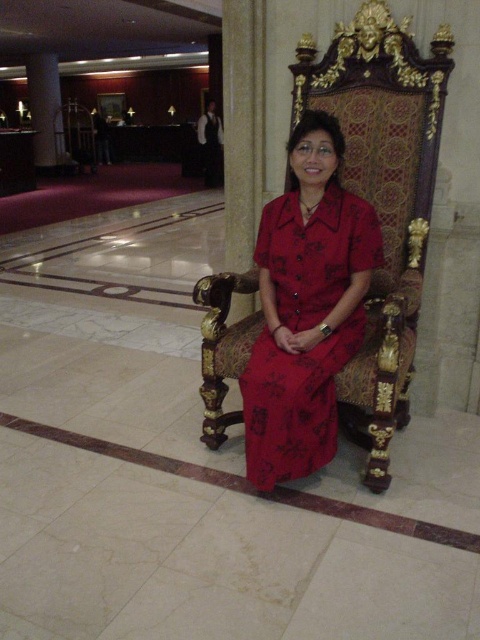
Consider the image. Is wooden carved throne at center thinner than matte red dress at center?

In fact, wooden carved throne at center might be wider than matte red dress at center.

Does wooden carved throne at center have a greater height compared to matte red dress at center?

Yes, wooden carved throne at center is taller than matte red dress at center.

Who is more distant from viewer, (409, 212) or (372, 228)?

The point (409, 212) is behind.

Locate an element on the screen. wooden carved throne at center is located at coordinates (383, 196).

In order to click on matte red dress at center in this screenshot , I will do `click(294, 403)`.

Does matte red dress at center lie in front of white marble pillar at upper left?

Yes, it is.

Between point (333, 260) and point (37, 120), which one is positioned behind?

Positioned behind is point (37, 120).

Where is `matte red dress at center`? The width and height of the screenshot is (480, 640). matte red dress at center is located at coordinates (294, 403).

Between wooden carved throne at center and white marble pillar at upper left, which one is positioned lower?

wooden carved throne at center is below.

Looking at this image, can you confirm if wooden carved throne at center is positioned to the left of white marble pillar at upper left?

Incorrect, wooden carved throne at center is not on the left side of white marble pillar at upper left.

The height and width of the screenshot is (640, 480). I want to click on wooden carved throne at center, so click(x=383, y=196).